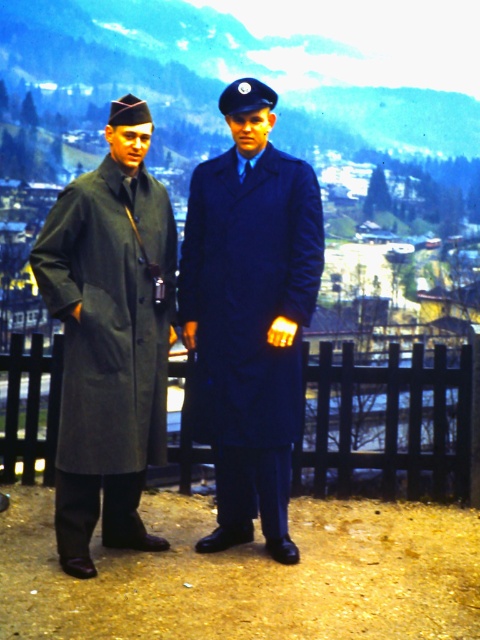
Question: Is matte blue coat at center below black wooden fence at center?

Choices:
 (A) no
 (B) yes

Answer: (A)

Question: Which is nearer to the matte gray coat at left?

Choices:
 (A) matte gray coat at center
 (B) matte blue coat at center
 (C) black wooden fence at center

Answer: (A)

Question: Can you confirm if matte blue coat at center is positioned to the left of black wooden fence at center?

Choices:
 (A) no
 (B) yes

Answer: (B)

Question: Considering the real-world distances, which object is farthest from the matte blue coat at center?

Choices:
 (A) matte gray coat at left
 (B) black wooden fence at center
 (C) matte gray coat at center

Answer: (B)

Question: Which point is farther from the camera taking this photo?

Choices:
 (A) (219, 154)
 (B) (249, 324)

Answer: (A)

Question: Does matte gray coat at center appear on the right side of matte blue coat at center?

Choices:
 (A) yes
 (B) no

Answer: (B)